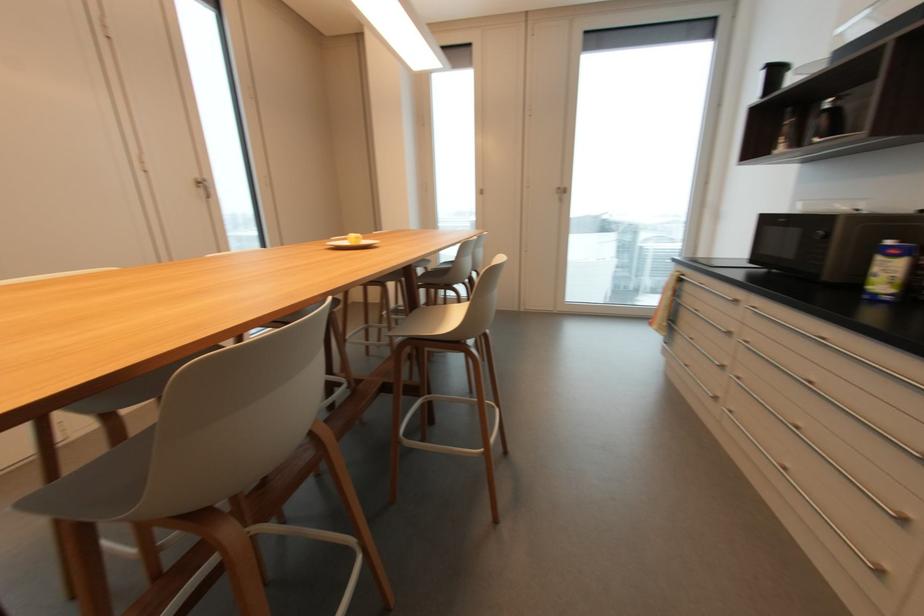
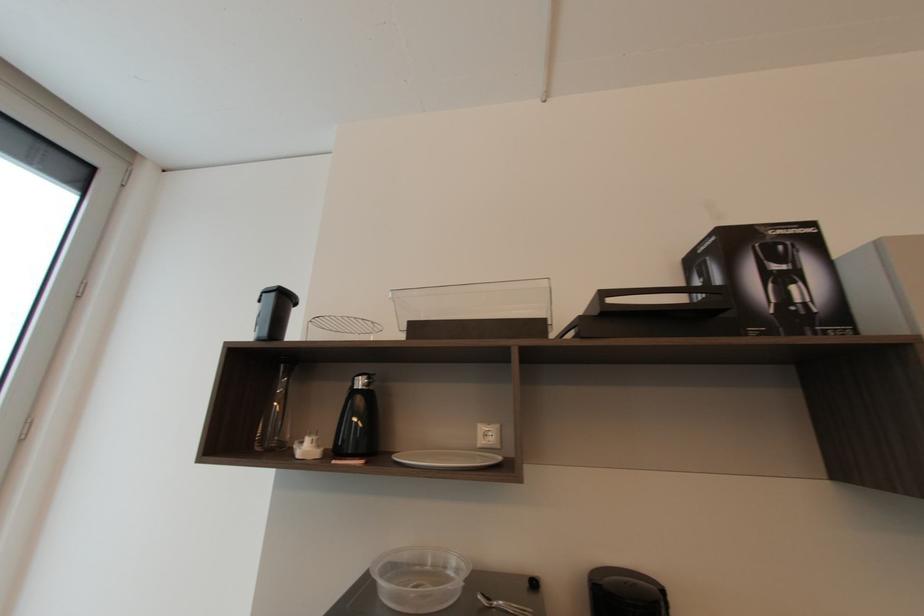
In the second image, find the point that corresponds to (786,148) in the first image.

(310, 447)